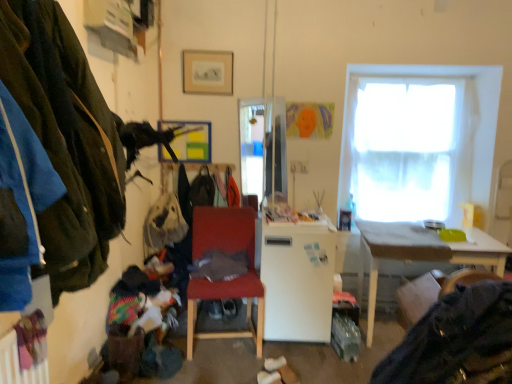
At what (x,y) coordinates should I click in order to perform the action: click on free space above transparent plastic door at center (from a real-world perspective). Please return your answer as a coordinate pair (x, y). Image resolution: width=512 pixels, height=384 pixels. Looking at the image, I should click on (263, 99).